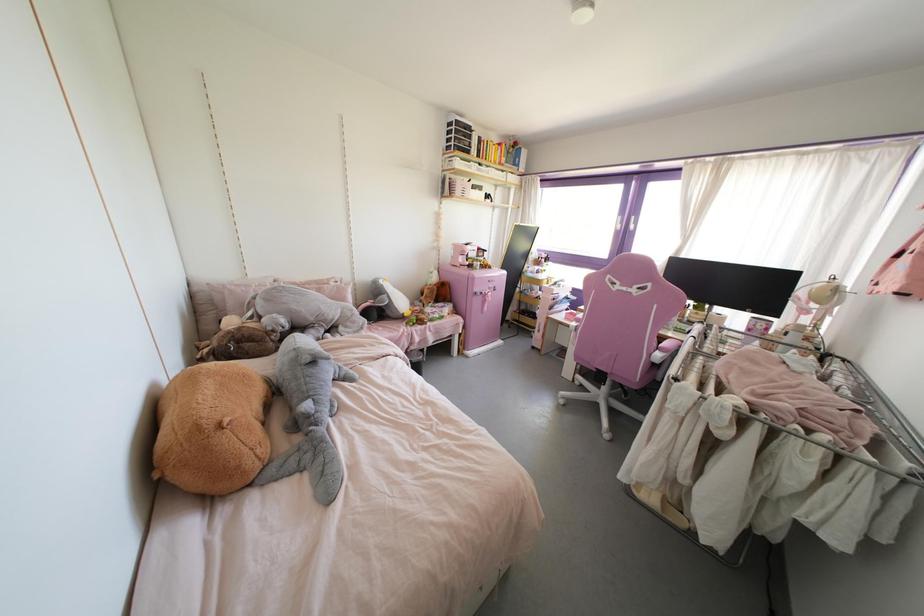
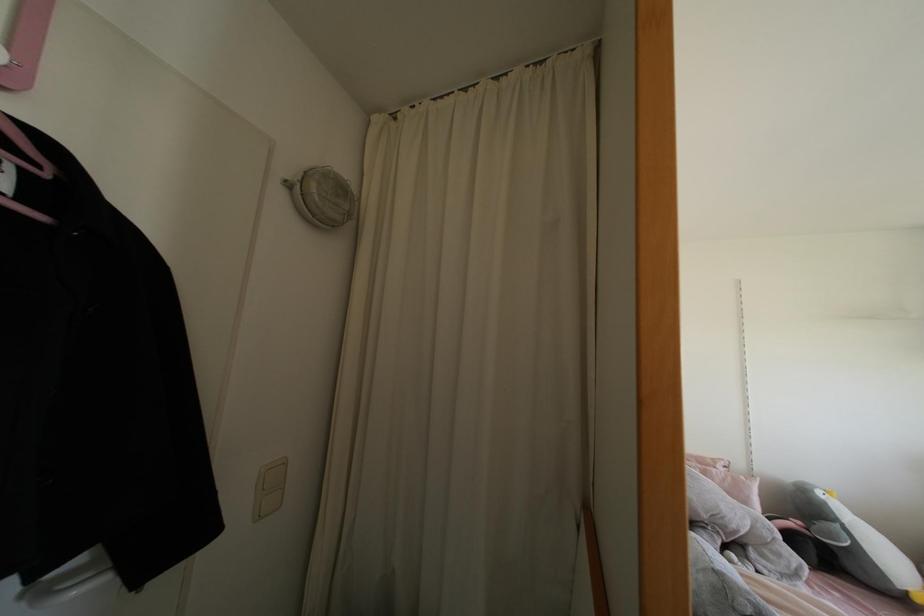
Locate, in the second image, the point that corresponds to point 329,278 in the first image.

(712, 460)